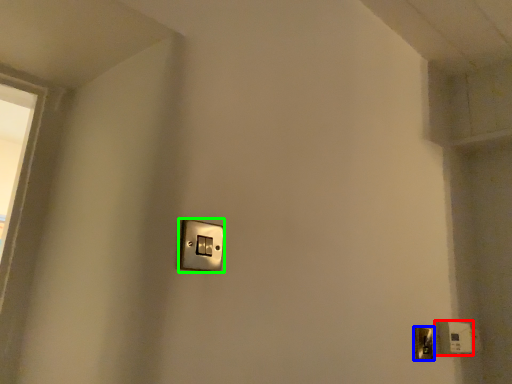
Question: Based on their relative distances, which object is farther from light switch (highlighted by a red box)? Choose from door handle (highlighted by a blue box) and light switch (highlighted by a green box).

Choices:
 (A) door handle
 (B) light switch

Answer: (B)